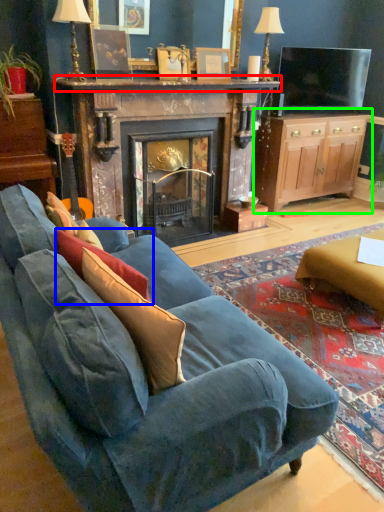
Question: Based on their relative distances, which object is nearer to mantle (highlighted by a red box)? Choose from pillow (highlighted by a blue box) and cabinetry (highlighted by a green box).

Choices:
 (A) pillow
 (B) cabinetry

Answer: (B)